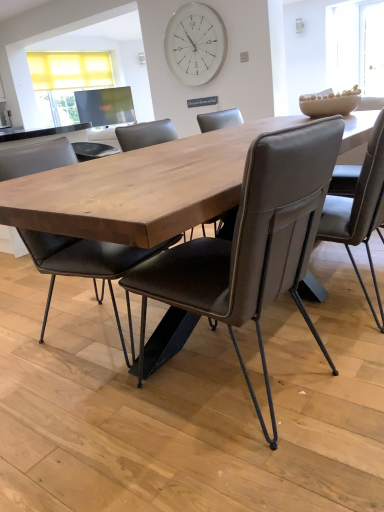
What is the approximate height of matte black chair at center, arranged as the 1th chair when viewed from the left?

36.07 inches.

In order to face leather-like chair at center, arranged as the first chair when viewed from the right, should I rotate leftwards or rightwards?

A 18.089 degree turn to the right will do.

The height and width of the screenshot is (512, 384). In order to click on matte black chair at center, arranged as the 1th chair when viewed from the left in this screenshot , I will do `click(85, 262)`.

Considering the sizes of objects brown leather chair at center, which is the 2th chair from right to left, and leather-like chair at center, arranged as the first chair when viewed from the right, in the image provided, who is bigger, brown leather chair at center, which is the 2th chair from right to left, or leather-like chair at center, arranged as the first chair when viewed from the right,?

brown leather chair at center, which is the 2th chair from right to left, is bigger.

In terms of height, does brown leather chair at center, marked as the second chair in a left-to-right arrangement, look taller or shorter compared to leather-like chair at center, placed as the 3th chair when sorted from left to right?

brown leather chair at center, marked as the second chair in a left-to-right arrangement, is taller than leather-like chair at center, placed as the 3th chair when sorted from left to right.

From the image's perspective, relative to leather-like chair at center, arranged as the first chair when viewed from the right, is brown leather chair at center, which is the 2th chair from right to left, above or below?

Clearly, from the image's perspective, brown leather chair at center, which is the 2th chair from right to left, is below leather-like chair at center, arranged as the first chair when viewed from the right.

Relative to leather-like chair at center, placed as the 3th chair when sorted from left to right, is brown leather chair at center, which is the 2th chair from right to left, in front or behind?

brown leather chair at center, which is the 2th chair from right to left, is in front of leather-like chair at center, placed as the 3th chair when sorted from left to right.

In the scene shown: Is brown leather chair at center, which is the 2th chair from right to left, wider or thinner than matte black chair at center, acting as the third chair starting from the right?

Considering their sizes, brown leather chair at center, which is the 2th chair from right to left, looks broader than matte black chair at center, acting as the third chair starting from the right.

Is brown leather chair at center, marked as the second chair in a left-to-right arrangement, aimed at matte black chair at center, arranged as the 1th chair when viewed from the left?

Yes, brown leather chair at center, marked as the second chair in a left-to-right arrangement, is aimed at matte black chair at center, arranged as the 1th chair when viewed from the left.

Looking at this image, can you confirm if brown leather chair at center, marked as the second chair in a left-to-right arrangement, is bigger than matte black chair at center, arranged as the 1th chair when viewed from the left?

No, brown leather chair at center, marked as the second chair in a left-to-right arrangement, is not bigger than matte black chair at center, arranged as the 1th chair when viewed from the left.

Can you confirm if brown leather chair at center, which is the 2th chair from right to left, is positioned to the left of matte black chair at center, arranged as the 1th chair when viewed from the left?

No, brown leather chair at center, which is the 2th chair from right to left, is not to the left of matte black chair at center, arranged as the 1th chair when viewed from the left.

Is white glass clock at upper center oriented away from brown leather chair at center, marked as the second chair in a left-to-right arrangement?

white glass clock at upper center does not have its back to brown leather chair at center, marked as the second chair in a left-to-right arrangement.

Is white glass clock at upper center positioned far away from brown leather chair at center, which is the 2th chair from right to left?

Yes, white glass clock at upper center and brown leather chair at center, which is the 2th chair from right to left, are quite far apart.

Can you confirm if white glass clock at upper center is wider than brown leather chair at center, marked as the second chair in a left-to-right arrangement?

In fact, white glass clock at upper center might be narrower than brown leather chair at center, marked as the second chair in a left-to-right arrangement.

Is white glass clock at upper center inside the boundaries of brown leather chair at center, marked as the second chair in a left-to-right arrangement, or outside?

white glass clock at upper center lies outside brown leather chair at center, marked as the second chair in a left-to-right arrangement.

Considering the sizes of objects white glass clock at upper center and matte black chair at center, acting as the third chair starting from the right, in the image provided, who is taller, white glass clock at upper center or matte black chair at center, acting as the third chair starting from the right,?

matte black chair at center, acting as the third chair starting from the right, is taller.

Is white glass clock at upper center oriented towards matte black chair at center, arranged as the 1th chair when viewed from the left?

Yes, white glass clock at upper center is oriented towards matte black chair at center, arranged as the 1th chair when viewed from the left.

How different are the orientations of white glass clock at upper center and matte black chair at center, acting as the third chair starting from the right, in degrees?

They differ by 93.2 degrees in their facing directions.

From a real-world perspective, who is located lower, white glass clock at upper center or matte black chair at center, acting as the third chair starting from the right?

From a 3D spatial view, matte black chair at center, acting as the third chair starting from the right, is below.

Considering the relative positions of brown leather chair at center, marked as the second chair in a left-to-right arrangement, and white glass clock at upper center in the image provided, is brown leather chair at center, marked as the second chair in a left-to-right arrangement, to the right of white glass clock at upper center from the viewer's perspective?

Yes, brown leather chair at center, marked as the second chair in a left-to-right arrangement, is to the right of white glass clock at upper center.

From the picture: Measure the distance from brown leather chair at center, marked as the second chair in a left-to-right arrangement, to white glass clock at upper center.

The distance of brown leather chair at center, marked as the second chair in a left-to-right arrangement, from white glass clock at upper center is 3.49 meters.

Is brown leather chair at center, which is the 2th chair from right to left, wider than white glass clock at upper center?

Correct, the width of brown leather chair at center, which is the 2th chair from right to left, exceeds that of white glass clock at upper center.

Where is `clock behind the brown leather chair at center, which is the 2th chair from right to left`? clock behind the brown leather chair at center, which is the 2th chair from right to left is located at coordinates (195, 44).

How many degrees apart are the facing directions of matte black chair at center, acting as the third chair starting from the right, and brown leather chair at center, marked as the second chair in a left-to-right arrangement?

173 degrees separate the facing orientations of matte black chair at center, acting as the third chair starting from the right, and brown leather chair at center, marked as the second chair in a left-to-right arrangement.

Considering the relative positions of matte black chair at center, acting as the third chair starting from the right, and brown leather chair at center, marked as the second chair in a left-to-right arrangement, in the image provided, is matte black chair at center, acting as the third chair starting from the right, to the right of brown leather chair at center, marked as the second chair in a left-to-right arrangement, from the viewer's perspective?

No.

From the picture: Which of these two, matte black chair at center, acting as the third chair starting from the right, or brown leather chair at center, which is the 2th chair from right to left, is bigger?

With larger size is matte black chair at center, acting as the third chair starting from the right.

From a real-world perspective, is matte black chair at center, acting as the third chair starting from the right, positioned over brown leather chair at center, which is the 2th chair from right to left, based on gravity?

No.

Considering the sizes of objects leather-like chair at center, arranged as the first chair when viewed from the right, and white glass clock at upper center in the image provided, who is smaller, leather-like chair at center, arranged as the first chair when viewed from the right, or white glass clock at upper center?

Smaller between the two is white glass clock at upper center.

In the scene shown: Are leather-like chair at center, placed as the 3th chair when sorted from left to right, and white glass clock at upper center far apart?

Absolutely, leather-like chair at center, placed as the 3th chair when sorted from left to right, is distant from white glass clock at upper center.

How many degrees apart are the facing directions of leather-like chair at center, arranged as the first chair when viewed from the right, and white glass clock at upper center?

The angular difference between leather-like chair at center, arranged as the first chair when viewed from the right, and white glass clock at upper center is 91.7 degrees.

Is leather-like chair at center, placed as the 3th chair when sorted from left to right, wider than white glass clock at upper center?

Correct, the width of leather-like chair at center, placed as the 3th chair when sorted from left to right, exceeds that of white glass clock at upper center.

Where is `chair that is the 1st one when counting leftward from the leather-like chair at center, placed as the 3th chair when sorted from left to right`? Image resolution: width=384 pixels, height=512 pixels. chair that is the 1st one when counting leftward from the leather-like chair at center, placed as the 3th chair when sorted from left to right is located at coordinates (252, 244).

Locate an element on the screen. The image size is (384, 512). chair in front of the matte black chair at center, arranged as the 1th chair when viewed from the left is located at coordinates (252, 244).

Based on their spatial positions, is white glass clock at upper center or leather-like chair at center, arranged as the first chair when viewed from the right, further from matte black chair at center, acting as the third chair starting from the right?

The object further to matte black chair at center, acting as the third chair starting from the right, is white glass clock at upper center.

Considering their positions, is brown leather chair at center, marked as the second chair in a left-to-right arrangement, positioned closer to leather-like chair at center, arranged as the first chair when viewed from the right, than white glass clock at upper center?

Among the two, brown leather chair at center, marked as the second chair in a left-to-right arrangement, is located nearer to leather-like chair at center, arranged as the first chair when viewed from the right.

From the image, which object appears to be nearer to brown leather chair at center, which is the 2th chair from right to left, matte black chair at center, arranged as the 1th chair when viewed from the left, or leather-like chair at center, arranged as the first chair when viewed from the right?

leather-like chair at center, arranged as the first chair when viewed from the right, lies closer to brown leather chair at center, which is the 2th chair from right to left, than the other object.

Which object lies nearer to the anchor point brown leather chair at center, which is the 2th chair from right to left, leather-like chair at center, placed as the 3th chair when sorted from left to right, or matte black chair at center, acting as the third chair starting from the right?

leather-like chair at center, placed as the 3th chair when sorted from left to right, is positioned closer to the anchor brown leather chair at center, which is the 2th chair from right to left.

From the image, which object appears to be farther from matte black chair at center, arranged as the 1th chair when viewed from the left, leather-like chair at center, arranged as the first chair when viewed from the right, or white glass clock at upper center?

Among the two, white glass clock at upper center is located further to matte black chair at center, arranged as the 1th chair when viewed from the left.

When comparing their distances from leather-like chair at center, arranged as the first chair when viewed from the right, does brown leather chair at center, which is the 2th chair from right to left, or matte black chair at center, arranged as the 1th chair when viewed from the left, seem closer?

brown leather chair at center, which is the 2th chair from right to left, is positioned closer to the anchor leather-like chair at center, arranged as the first chair when viewed from the right.

Looking at the image, which one is located closer to brown leather chair at center, marked as the second chair in a left-to-right arrangement, leather-like chair at center, placed as the 3th chair when sorted from left to right, or white glass clock at upper center?

leather-like chair at center, placed as the 3th chair when sorted from left to right, is positioned closer to the anchor brown leather chair at center, marked as the second chair in a left-to-right arrangement.

Based on their spatial positions, is matte black chair at center, arranged as the 1th chair when viewed from the left, or white glass clock at upper center closer to brown leather chair at center, which is the 2th chair from right to left?

matte black chair at center, arranged as the 1th chair when viewed from the left, is closer to brown leather chair at center, which is the 2th chair from right to left.

In order to click on chair between matte black chair at center, acting as the third chair starting from the right, and leather-like chair at center, arranged as the first chair when viewed from the right in this screenshot , I will do `click(252, 244)`.

What are the coordinates of `chair between matte black chair at center, arranged as the 1th chair when viewed from the left, and white glass clock at upper center in the front-back direction` in the screenshot? It's located at (364, 186).